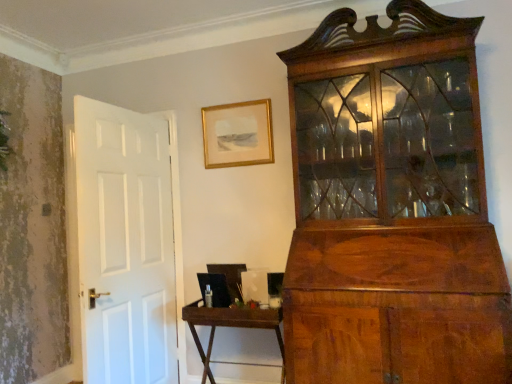
You are a GUI agent. You are given a task and a screenshot of the screen. Output one action in this format:
    pyautogui.click(x=<x>, y=<y>)
    Task: Click on the vacant space situated above brown wooden table at center (from a real-world perspective)
    
    Given the screenshot: What is the action you would take?
    pyautogui.click(x=240, y=308)